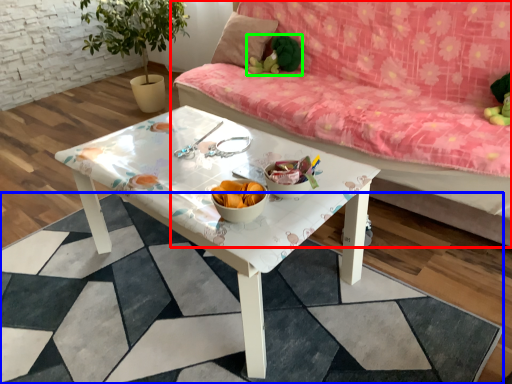
Question: Estimate the real-world distances between objects in this image. Which object is farther from studio couch (highlighted by a red box), square (highlighted by a blue box) or toy (highlighted by a green box)?

Choices:
 (A) square
 (B) toy

Answer: (A)